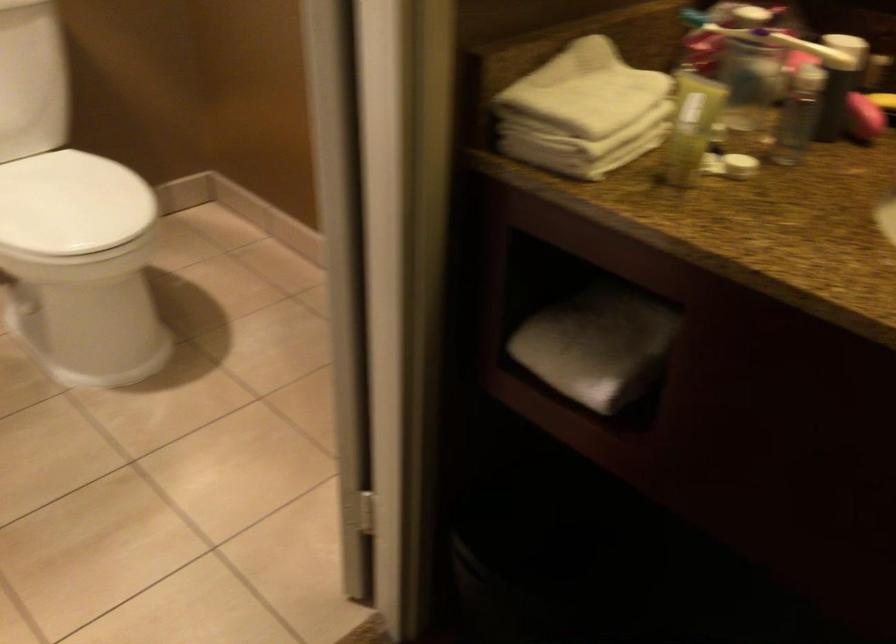
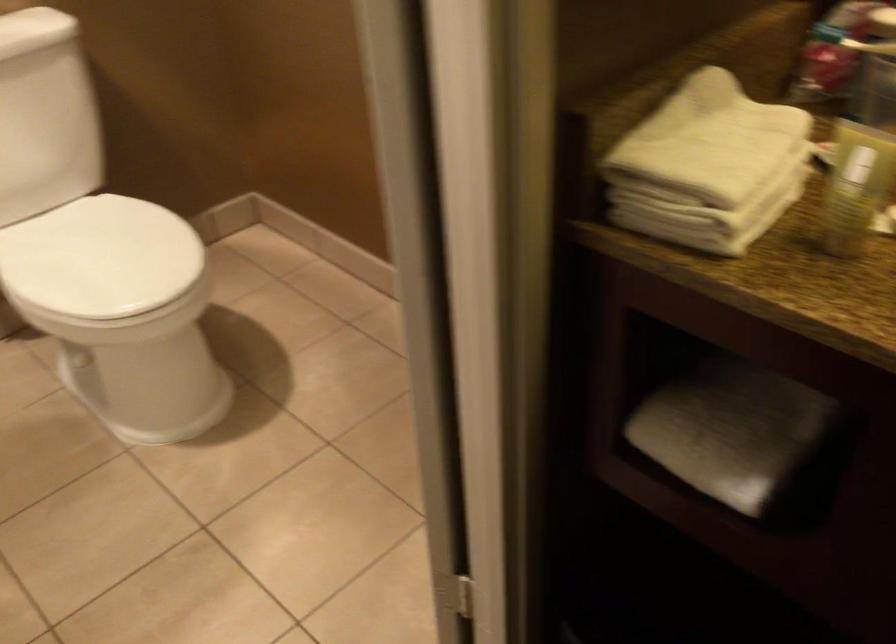
Question: The camera is either moving clockwise (left) or counter-clockwise (right) around the object. The first image is from the beginning of the video and the second image is from the end. Is the camera moving left or right when shooting the video?

Choices:
 (A) Left
 (B) Right

Answer: (B)